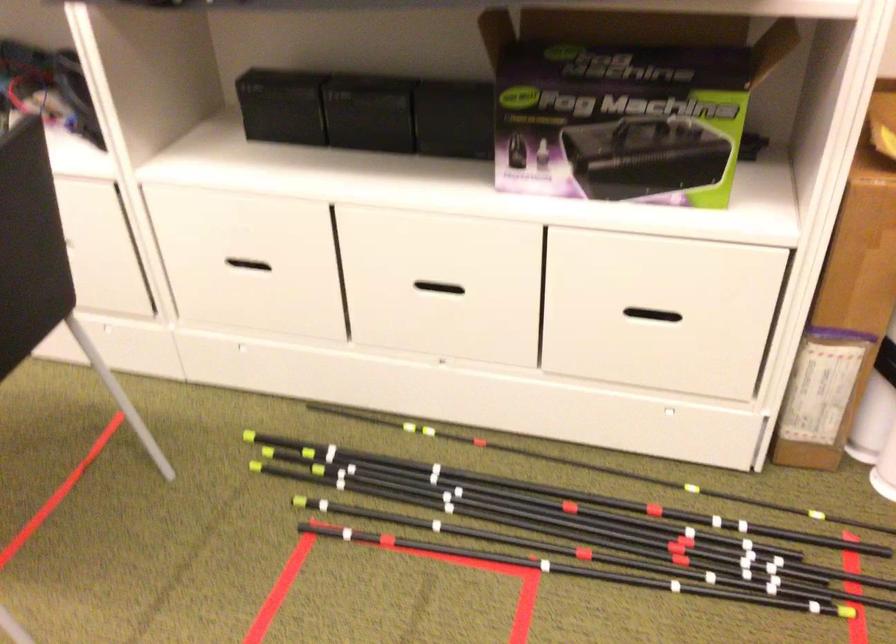
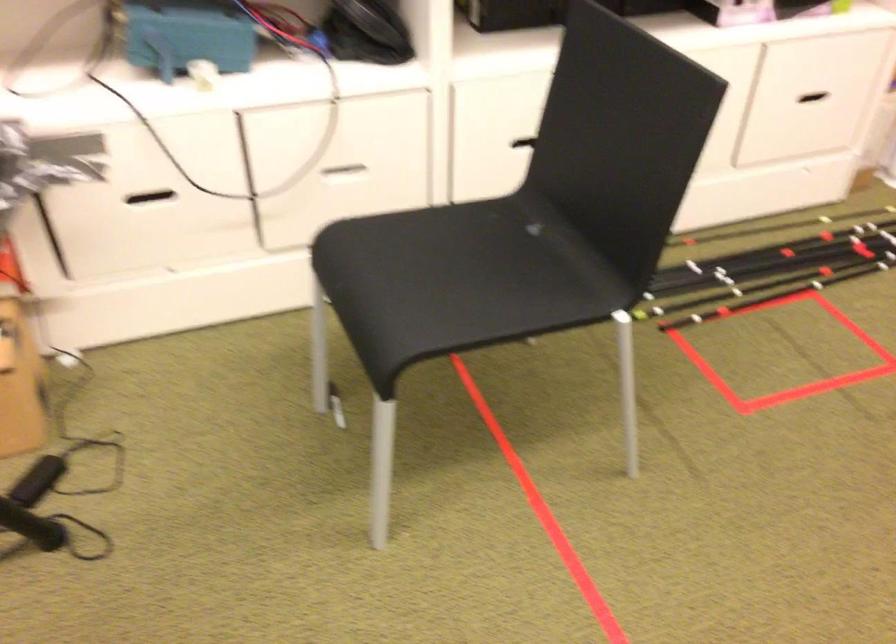
Question: I am providing you with two images of the same scene from different viewpoints. Which of the following objects are not visible in image2?

Choices:
 (A) white drawer handle
 (B) drawer handle
 (C) lathe handwheel
 (D) chair sitting surface

Answer: (A)